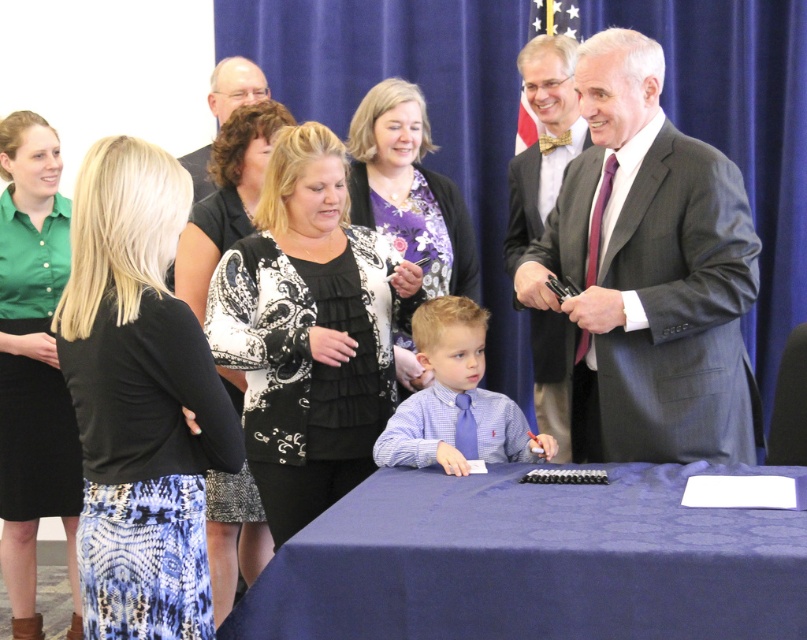
Between floral-patterned blouse at center and blue satin shirt at center, which one has less height?

blue satin shirt at center is shorter.

Is floral-patterned blouse at center shorter than blue satin shirt at center?

No.

The height and width of the screenshot is (640, 807). Identify the location of floral-patterned blouse at center. (408, 188).

Can you confirm if matte gray suit at upper right is smaller than matte black shirt at upper center?

Actually, matte gray suit at upper right might be larger than matte black shirt at upper center.

Who is more distant from viewer, [552,180] or [226,102]?

Point [226,102]

Who is more forward, (582, 131) or (185, 163)?

Point (582, 131) is more forward.

At what (x,y) coordinates should I click in order to perform the action: click on matte gray suit at upper right. Please return your answer as a coordinate pair (x, y). Looking at the image, I should click on (542, 140).

Is gray suit at right behind black textured skirt at left?

Yes, gray suit at right is behind black textured skirt at left.

Is point (665, 282) farther from camera compared to point (140, 412)?

Yes, point (665, 282) is behind point (140, 412).

Locate an element on the screen. gray suit at right is located at coordinates (649, 273).